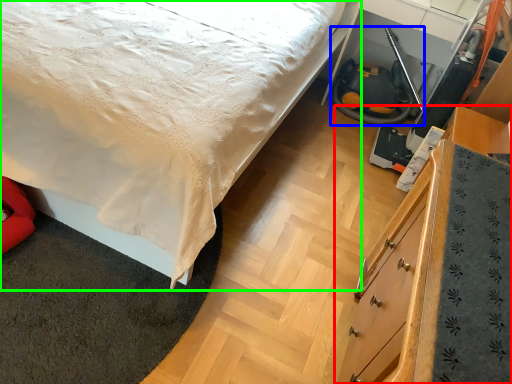
Question: Considering the real-world distances, which object is closest to chest of drawers (highlighted by a red box)? fire hose (highlighted by a blue box) or bed (highlighted by a green box).

Choices:
 (A) fire hose
 (B) bed

Answer: (B)